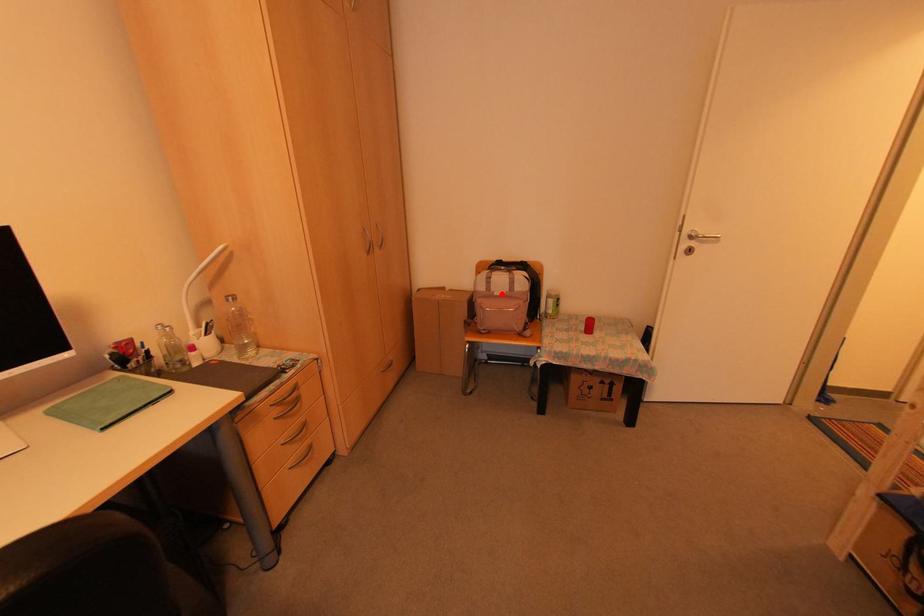
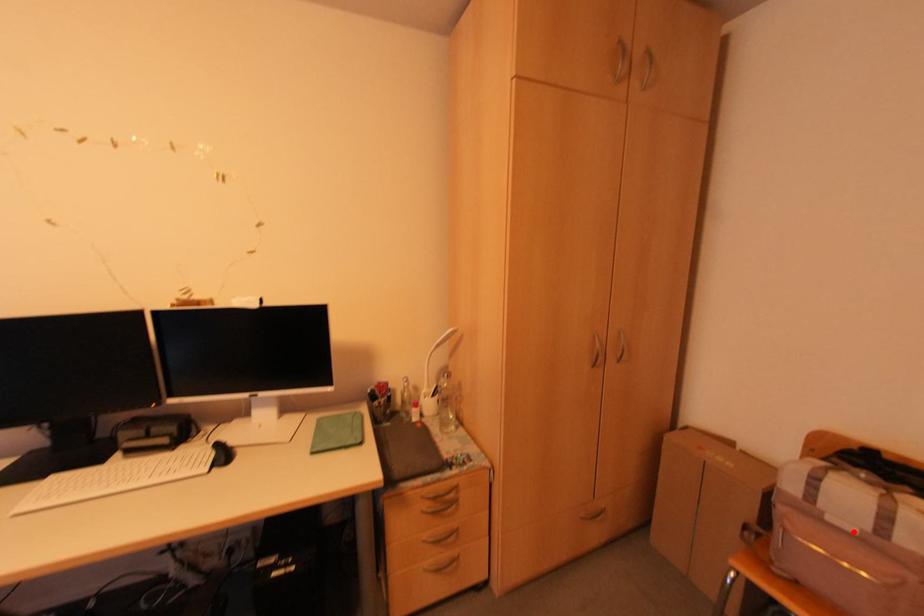
I am providing you with two images of the same scene from different viewpoints. A red point is marked on the first image and another point is marked on the second image. Does the point marked in image1 correspond to the same location as the one in image2?

Yes